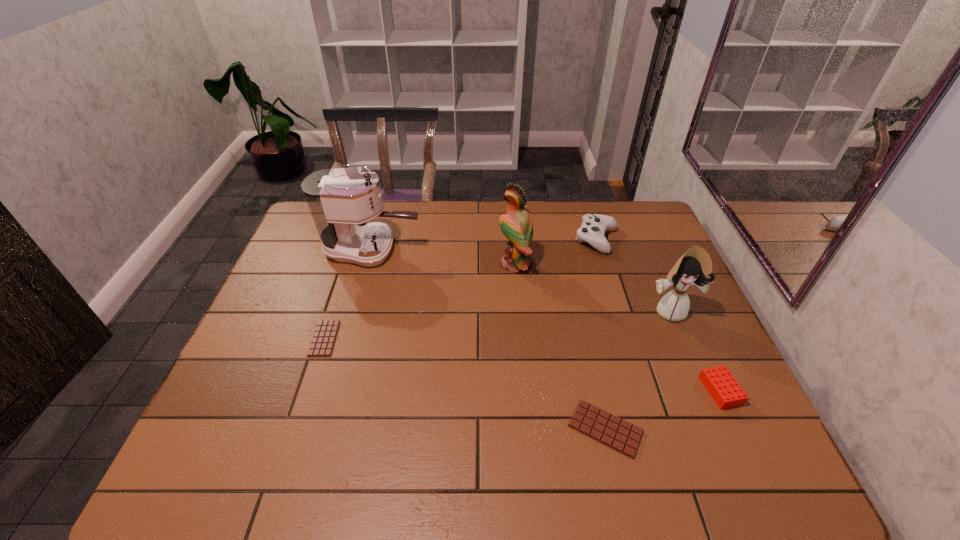
The image size is (960, 540). I want to click on vacant region that satisfies the following two spatial constraints: 1. on the back side of the fifth tallest object; 2. on the front-facing side of the coffee maker, so click(x=656, y=249).